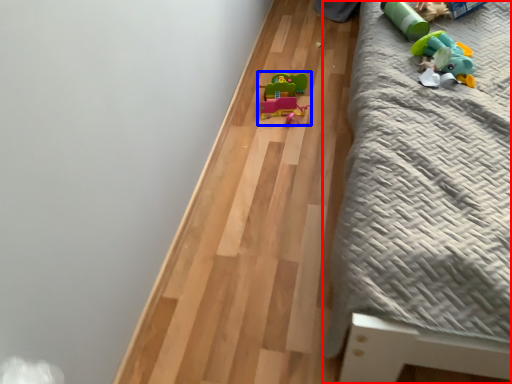
Question: Which point is further to the camera, furniture (highlighted by a red box) or toy (highlighted by a blue box)?

Choices:
 (A) furniture
 (B) toy

Answer: (B)